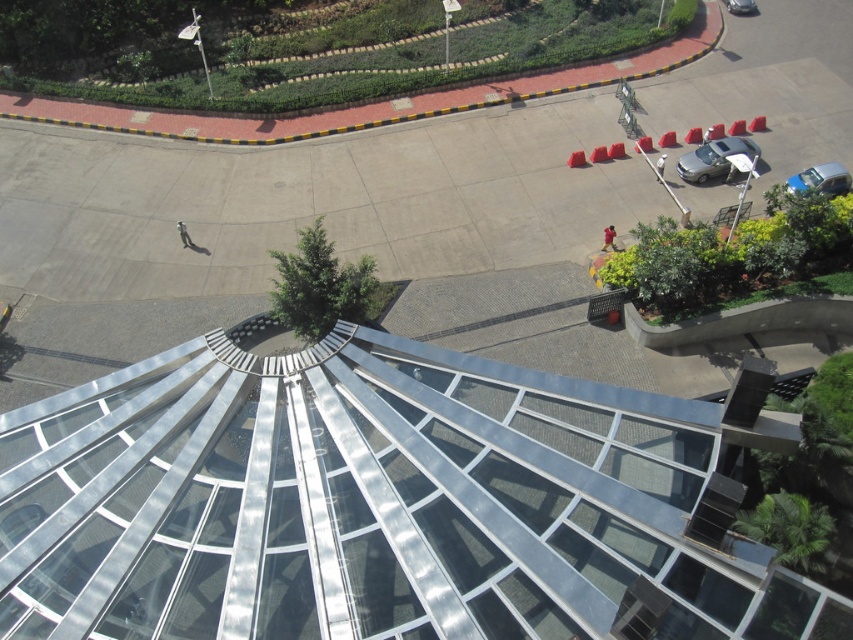
Between point (158, 424) and point (814, 173), which one is positioned behind?

Point (814, 173)

Is point (601, 593) farther from camera compared to point (846, 188)?

No.

This screenshot has height=640, width=853. What are the coordinates of `metallic glass pyramid at center` in the screenshot? It's located at (380, 502).

This screenshot has height=640, width=853. I want to click on metallic glass pyramid at center, so click(380, 502).

Is satin silver sedan at right taller than blue metallic car at lower right?

Indeed, satin silver sedan at right has a greater height compared to blue metallic car at lower right.

Image resolution: width=853 pixels, height=640 pixels. Identify the location of satin silver sedan at right. (712, 157).

Can you confirm if blue metallic car at lower right is wider than silver metallic car at upper right?

In fact, blue metallic car at lower right might be narrower than silver metallic car at upper right.

Can you confirm if blue metallic car at lower right is smaller than silver metallic car at upper right?

Yes, blue metallic car at lower right is smaller than silver metallic car at upper right.

Is point (817, 177) more distant than point (735, 8)?

No, (817, 177) is closer to viewer.

The height and width of the screenshot is (640, 853). What are the coordinates of `blue metallic car at lower right` in the screenshot? It's located at (821, 179).